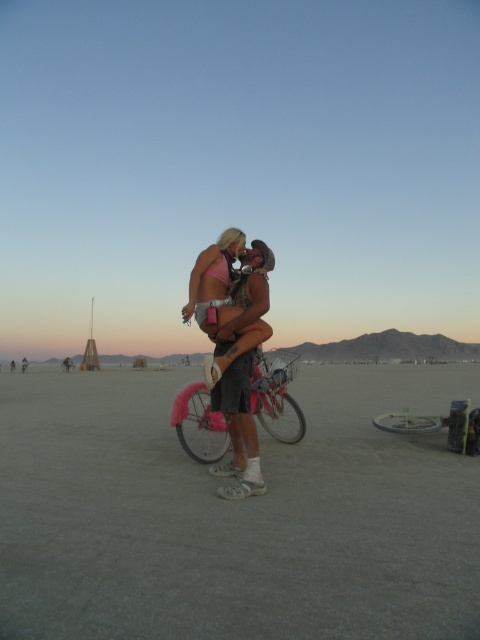
You are planning to take a photo of the pink fabric bikini top at center and the pink fluffy bicycle at center. Which object should you focus on first if you want to capture both in the same frame without moving the camera?

The pink fabric bikini top at center is smaller than the pink fluffy bicycle at center, so you should focus on the pink fluffy bicycle at center first to ensure it fits well in the frame before adjusting for the smaller bikini top.

You are standing in the desert at twilight and see two points in the scene. The first point is at coordinates point (228, 257) and the second point is at point (268, 417). Which point is nearer to you?

Point (228, 257) is closer to the viewer than point (268, 417).